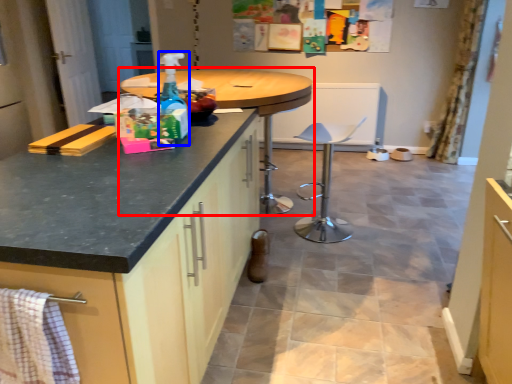
Question: Which object is closer to the camera taking this photo, table (highlighted by a red box) or bottle (highlighted by a blue box)?

Choices:
 (A) table
 (B) bottle

Answer: (B)